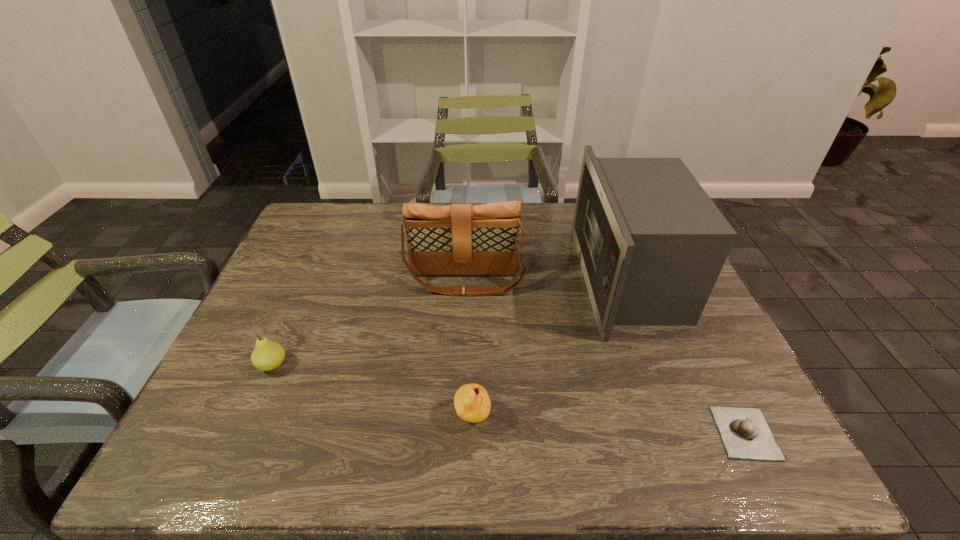
Identify the location of object at the near right corner. (745, 434).

Image resolution: width=960 pixels, height=540 pixels. In the image, there is a desktop. Identify the location of blank space at the far edge. (362, 231).

The image size is (960, 540). Find the location of `vacant region at the near edge`. vacant region at the near edge is located at coordinates (377, 468).

The width and height of the screenshot is (960, 540). What are the coordinates of `free space at the left edge` in the screenshot? It's located at (270, 332).

I want to click on free space at the right edge of the desktop, so click(684, 345).

The image size is (960, 540). In the image, there is a desktop. Find the location of `free space at the far left corner`. free space at the far left corner is located at coordinates (328, 230).

At what (x,y) coordinates should I click in order to perform the action: click on vacant point located between the nearer pear and the garlic. Please return your answer as a coordinate pair (x, y). Looking at the image, I should click on (609, 424).

Find the location of a particular element. free point between the garlic and the farther pear is located at coordinates (509, 399).

Locate an element on the screen. The width and height of the screenshot is (960, 540). vacant region between the microwave oven and the left pear is located at coordinates (450, 322).

This screenshot has width=960, height=540. I want to click on free point between the second tallest object and the tallest object, so click(x=546, y=279).